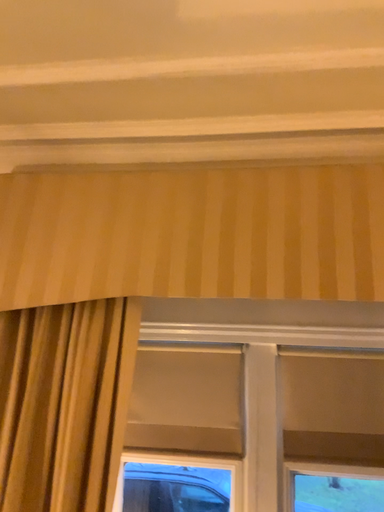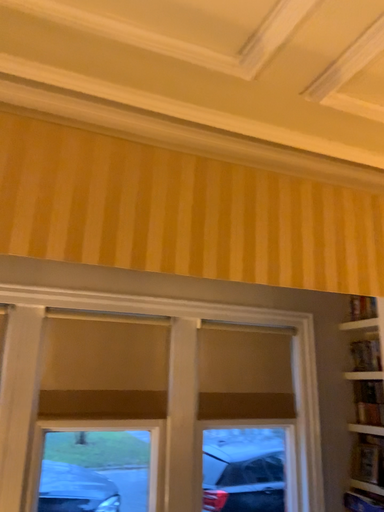
Question: How did the camera likely rotate when shooting the video?

Choices:
 (A) rotated right
 (B) rotated left

Answer: (A)